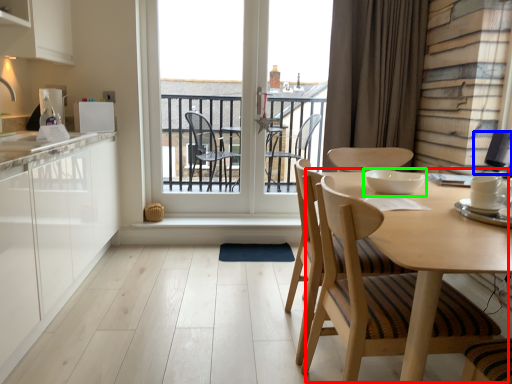
Question: Considering the real-world distances, which object is farthest from round table (highlighted by a red box)? appliance (highlighted by a blue box) or appliance (highlighted by a green box)?

Choices:
 (A) appliance
 (B) appliance

Answer: (A)